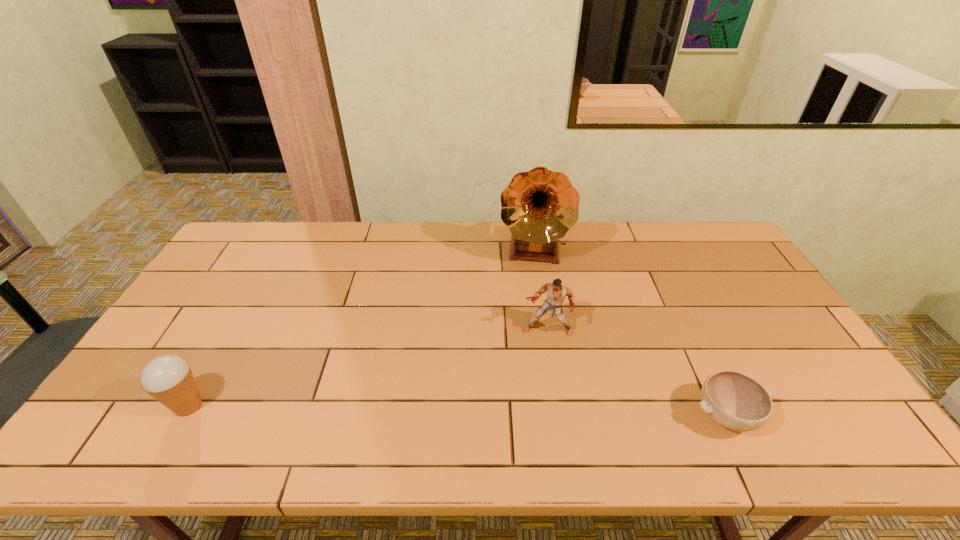
I want to click on vacant space located on the front-facing side of the puncher, so click(x=535, y=363).

Find the location of a particular element. free space located on the horn of the phonograph_record is located at coordinates (525, 357).

Find the location of a particular element. This screenshot has width=960, height=540. vacant space located 0.140m on the horn of the phonograph_record is located at coordinates (528, 303).

Image resolution: width=960 pixels, height=540 pixels. I want to click on vacant space located 0.300m on the horn of the phonograph_record, so click(526, 343).

You are a GUI agent. You are given a task and a screenshot of the screen. Output one action in this format:
    pyautogui.click(x=<x>, y=<y>)
    Task: Click on the object present at the far edge
    This screenshot has width=960, height=540.
    Given the screenshot: What is the action you would take?
    pyautogui.click(x=539, y=207)

Identify the location of icecream present at the near edge. (169, 379).

Locate an element on the screen. The image size is (960, 540). bowl that is at the near edge is located at coordinates (736, 401).

The width and height of the screenshot is (960, 540). What are the coordinates of `object that is positioned at the left edge` in the screenshot? It's located at (169, 379).

The height and width of the screenshot is (540, 960). In order to click on object that is at the near left corner in this screenshot , I will do `click(169, 379)`.

I want to click on free space at the far edge of the desktop, so click(439, 241).